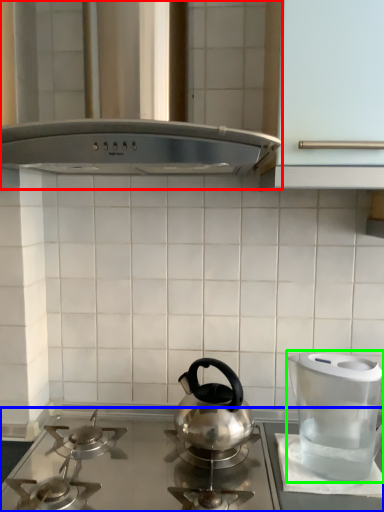
Question: Which object is positioned closest to vent (highlighted by a red box)? Select from gas stove (highlighted by a blue box) and kitchen appliance (highlighted by a green box).

Choices:
 (A) gas stove
 (B) kitchen appliance

Answer: (B)